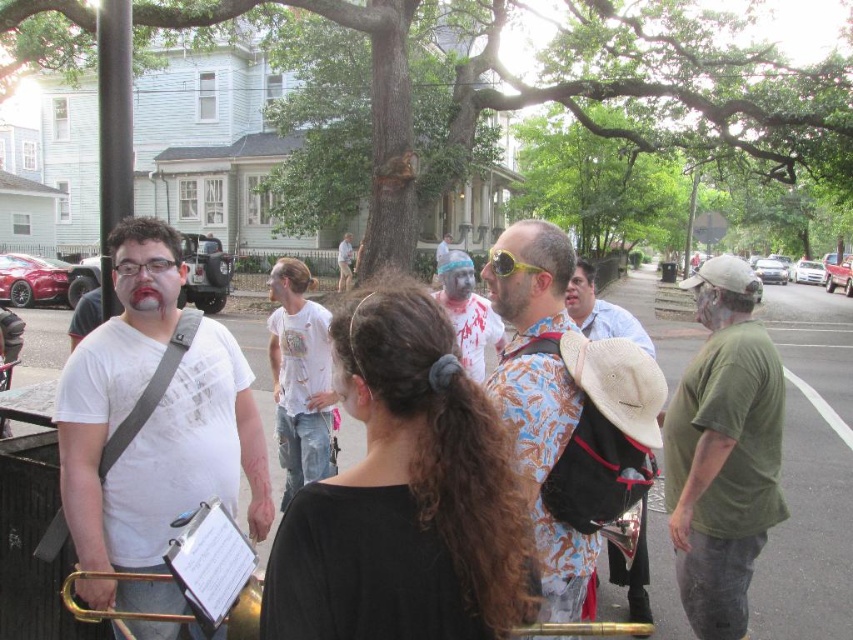
Question: Is white cotton t-shirt at center smaller than floral fabric shirt at center?

Choices:
 (A) no
 (B) yes

Answer: (A)

Question: Estimate the real-world distances between objects in this image. Which object is farther from the green cotton shirt at right?

Choices:
 (A) floral-patterned shirt at center
 (B) floral fabric shirt at center

Answer: (A)

Question: Does green cotton shirt at right come behind floral fabric shirt at center?

Choices:
 (A) no
 (B) yes

Answer: (A)

Question: Which object appears closest to the camera in this image?

Choices:
 (A) white matte t-shirt at left
 (B) green cotton shirt at right
 (C) floral fabric shirt at center
 (D) gold brass trumpet at lower left

Answer: (D)

Question: Does floral-patterned shirt at center appear on the left side of white cotton t-shirt at center?

Choices:
 (A) no
 (B) yes

Answer: (A)

Question: Among these objects, which one is nearest to the camera?

Choices:
 (A) floral-patterned shirt at center
 (B) green cotton shirt at right

Answer: (A)